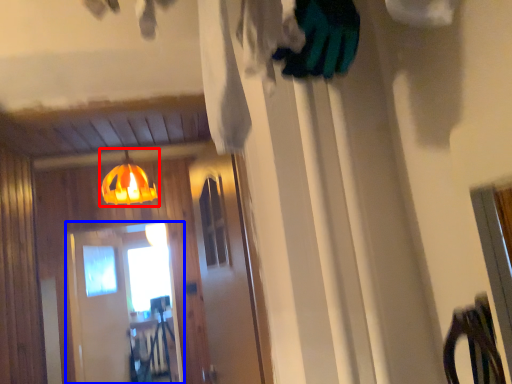
Question: Which object appears closest to the camera in this image, lamp (highlighted by a red box) or screen door (highlighted by a blue box)?

Choices:
 (A) lamp
 (B) screen door

Answer: (A)